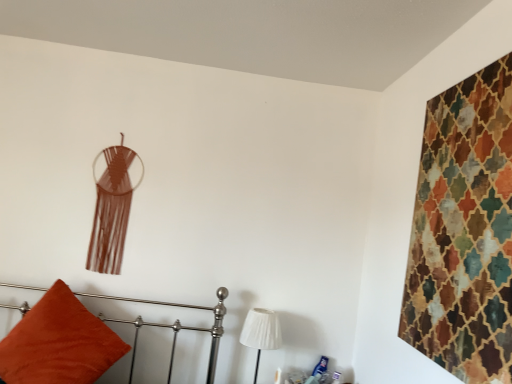
Question: Does textured multicolored tapestry at upper right have a smaller size compared to velvet orange pillow at lower left?

Choices:
 (A) yes
 (B) no

Answer: (A)

Question: Could you tell me if textured multicolored tapestry at upper right is facing velvet orange pillow at lower left?

Choices:
 (A) yes
 (B) no

Answer: (A)

Question: Does textured multicolored tapestry at upper right have a lesser width compared to velvet orange pillow at lower left?

Choices:
 (A) no
 (B) yes

Answer: (B)

Question: From the image's perspective, would you say textured multicolored tapestry at upper right is shown under velvet orange pillow at lower left?

Choices:
 (A) no
 (B) yes

Answer: (A)

Question: Considering the relative positions of textured multicolored tapestry at upper right and velvet orange pillow at lower left in the image provided, is textured multicolored tapestry at upper right to the left of velvet orange pillow at lower left from the viewer's perspective?

Choices:
 (A) yes
 (B) no

Answer: (B)

Question: From their relative heights in the image, would you say velvet orange pillow at lower left is taller or shorter than textured multicolored tapestry at upper right?

Choices:
 (A) short
 (B) tall

Answer: (A)

Question: Relative to textured multicolored tapestry at upper right, is velvet orange pillow at lower left in front or behind?

Choices:
 (A) front
 (B) behind

Answer: (B)

Question: Considering the relative positions of velvet orange pillow at lower left and textured multicolored tapestry at upper right in the image provided, is velvet orange pillow at lower left to the left or to the right of textured multicolored tapestry at upper right?

Choices:
 (A) left
 (B) right

Answer: (A)

Question: Does point (102, 296) appear closer or farther from the camera than point (502, 324)?

Choices:
 (A) closer
 (B) farther

Answer: (B)

Question: Relative to velvet orange pillow at lower left, is white pleated fabric at lower center in front or behind?

Choices:
 (A) front
 (B) behind

Answer: (B)

Question: Considering the positions of white pleated fabric at lower center and velvet orange pillow at lower left in the image, is white pleated fabric at lower center wider or thinner than velvet orange pillow at lower left?

Choices:
 (A) wide
 (B) thin

Answer: (B)

Question: Is white pleated fabric at lower center spatially inside velvet orange pillow at lower left, or outside of it?

Choices:
 (A) inside
 (B) outside

Answer: (B)

Question: From the image's perspective, is white pleated fabric at lower center located above or below velvet orange pillow at lower left?

Choices:
 (A) above
 (B) below

Answer: (B)

Question: Considering the positions of point (471, 140) and point (265, 334), is point (471, 140) closer or farther from the camera than point (265, 334)?

Choices:
 (A) farther
 (B) closer

Answer: (B)

Question: Based on their positions, is textured multicolored tapestry at upper right located to the left or right of white pleated fabric at lower center?

Choices:
 (A) left
 (B) right

Answer: (B)